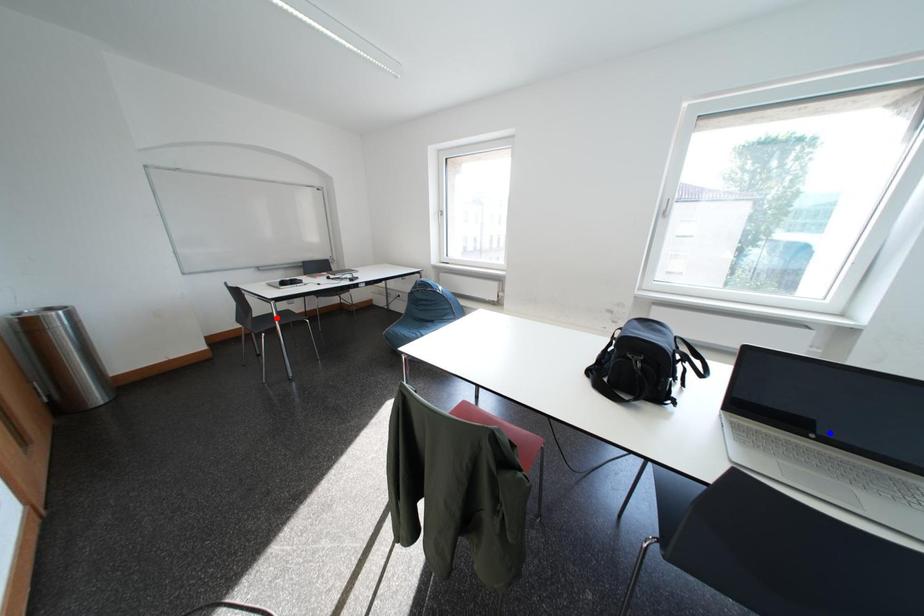
Question: In the image, two points are highlighted. Which point is nearer to the camera? Reply with the corresponding letter.

Choices:
 (A) blue point
 (B) red point

Answer: (A)